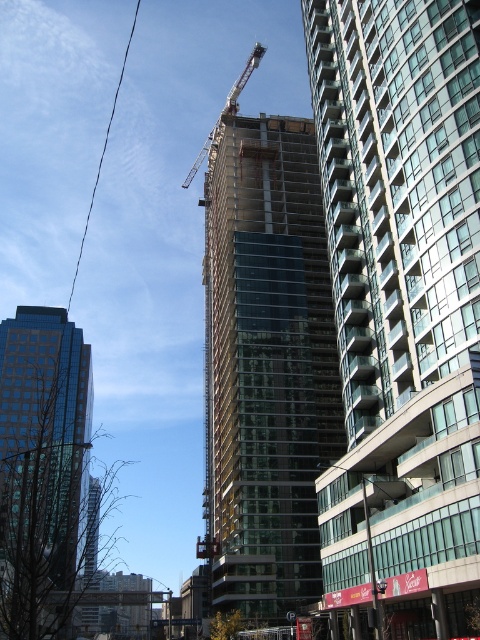
Based on the scene description, what are the coordinates of the clear glass building at center?

The clear glass building at center is located at coordinates point [402,307].

You are an architect evaluating the urban layout. Given the clear glass building at center and the shiny glass skyscraper at left, which one has a narrower structure?

The clear glass building at center has a narrower structure than the shiny glass skyscraper at left because its width is less than the skyscraper.

In the scene shown: You are an architect planning to install a large billboard on the side of the transparent glass building at center. The billboard requires a space that is wider than the metallic gray crane at upper center. Based on the scene, will the billboard fit on the building?

The transparent glass building at center has a width less than the metallic gray crane at upper center, so the billboard requiring a wider space than the crane would not fit on the building.